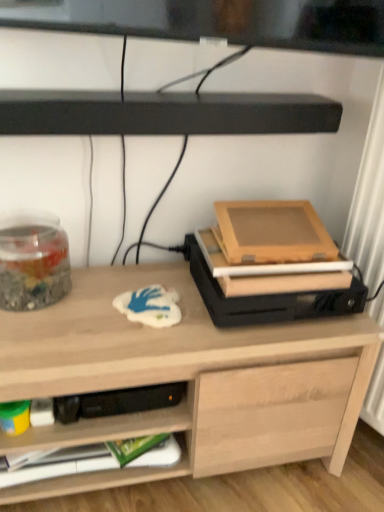
Question: Considering the relative sizes of green matte paperback book at lower left and transparent glass jar at left in the image provided, is green matte paperback book at lower left smaller than transparent glass jar at left?

Choices:
 (A) yes
 (B) no

Answer: (A)

Question: Does green matte paperback book at lower left have a lesser width compared to transparent glass jar at left?

Choices:
 (A) yes
 (B) no

Answer: (A)

Question: Is transparent glass jar at left a part of green matte paperback book at lower left?

Choices:
 (A) no
 (B) yes

Answer: (A)

Question: From the image's perspective, is green matte paperback book at lower left beneath transparent glass jar at left?

Choices:
 (A) yes
 (B) no

Answer: (A)

Question: From a real-world perspective, is green matte paperback book at lower left positioned under transparent glass jar at left based on gravity?

Choices:
 (A) yes
 (B) no

Answer: (A)

Question: Is green matte paperback book at lower left closer to the viewer compared to transparent glass jar at left?

Choices:
 (A) no
 (B) yes

Answer: (A)

Question: Can you confirm if transparent glass jar at left is thinner than green matte paperback book at lower left?

Choices:
 (A) yes
 (B) no

Answer: (B)

Question: From a real-world perspective, is transparent glass jar at left physically below green matte paperback book at lower left?

Choices:
 (A) yes
 (B) no

Answer: (B)

Question: Is the depth of transparent glass jar at left greater than that of green matte paperback book at lower left?

Choices:
 (A) no
 (B) yes

Answer: (A)

Question: Is transparent glass jar at left in front of green matte paperback book at lower left?

Choices:
 (A) yes
 (B) no

Answer: (A)

Question: Could you tell me if transparent glass jar at left is facing green matte paperback book at lower left?

Choices:
 (A) no
 (B) yes

Answer: (A)

Question: Does transparent glass jar at left have a greater width compared to green matte paperback book at lower left?

Choices:
 (A) no
 (B) yes

Answer: (B)

Question: Considering the relative sizes of light wood desk at center and black matte soundbar at upper center in the image provided, is light wood desk at center bigger than black matte soundbar at upper center?

Choices:
 (A) no
 (B) yes

Answer: (B)